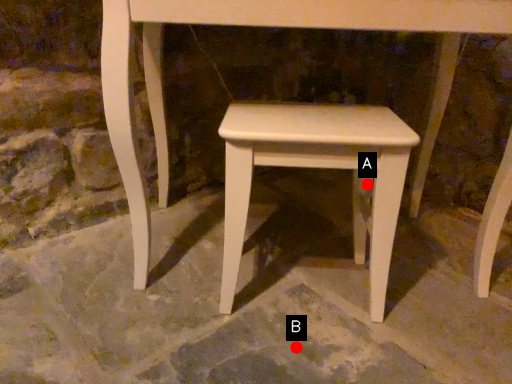
Question: Two points are circled on the image, labeled by A and B beside each circle. Which point is farther to the camera?

Choices:
 (A) A is further
 (B) B is further

Answer: (A)